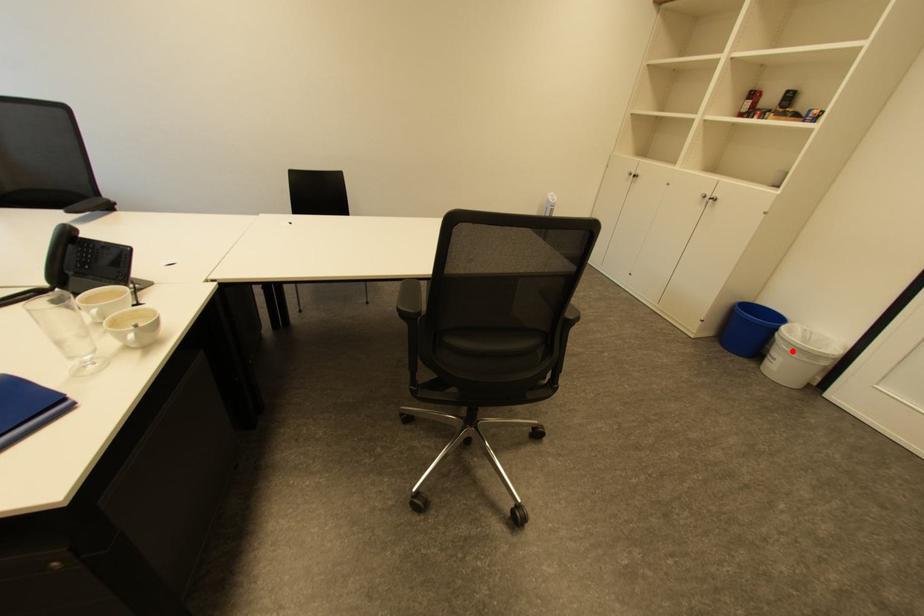
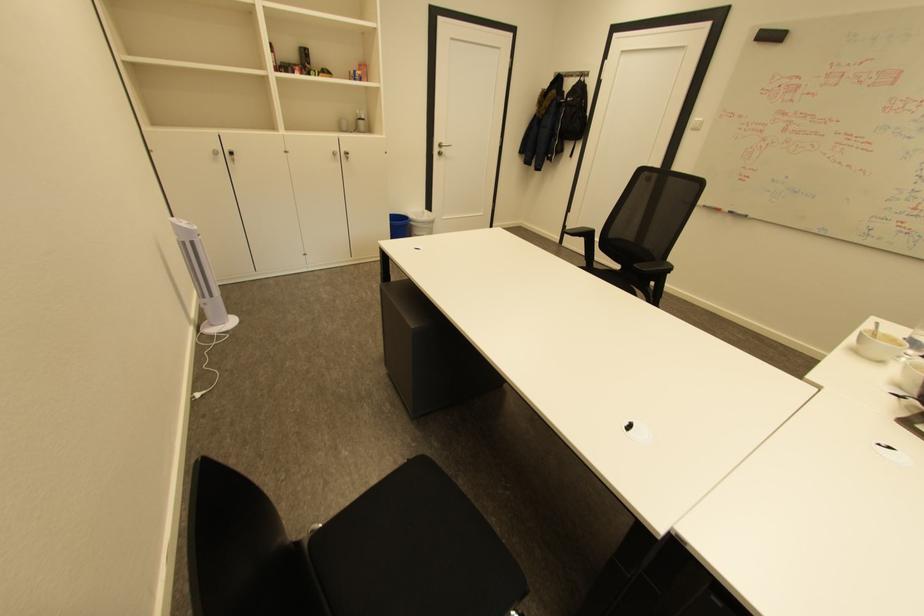
Find the pixel in the second image that matches the highlighted location in the first image.

(432, 227)